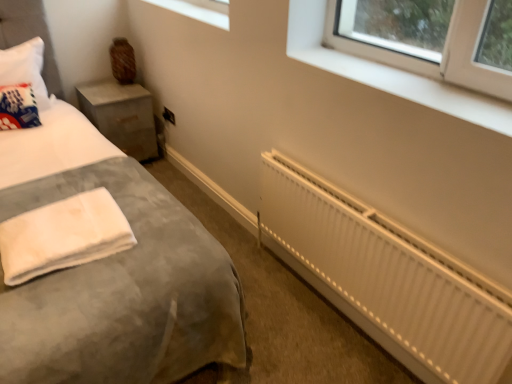
At what (x,y) coordinates should I click in order to perform the action: click on vacant region below white metallic radiator at lower right (from a real-world perspective). Please return your answer as a coordinate pair (x, y). The width and height of the screenshot is (512, 384). Looking at the image, I should click on tap(333, 314).